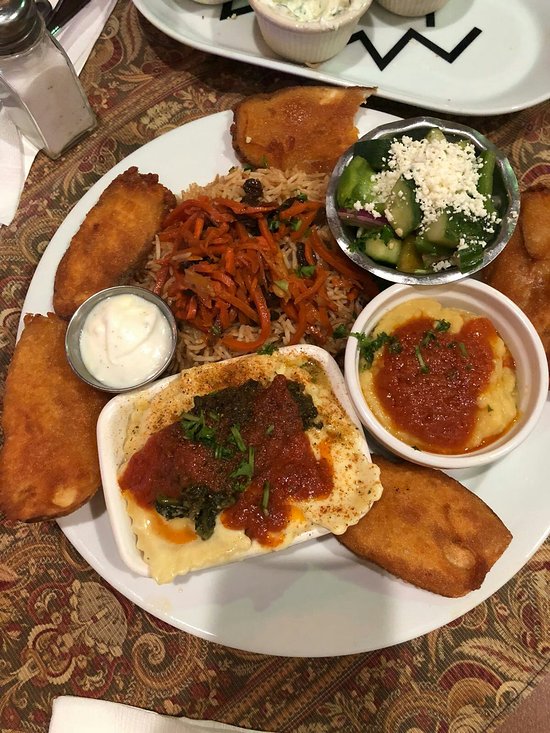
This screenshot has height=733, width=550. Find the location of `white rectangular dish`. white rectangular dish is located at coordinates (126, 552).